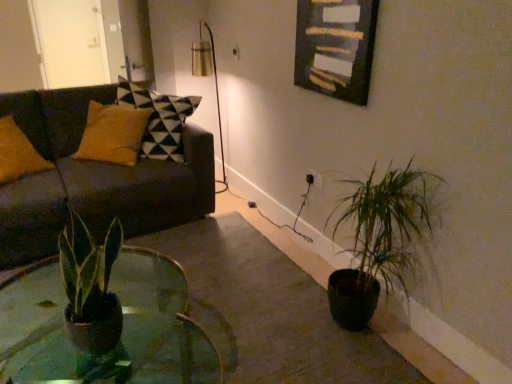
Find the location of `metallic gold table lamp at upper center`. metallic gold table lamp at upper center is located at coordinates (214, 81).

In order to face green glass coffee table at center, should I rotate leftwards or rightwards?

It's best to rotate left around 19.432 degrees.

Measure the distance between green glass coffee table at center and camera.

green glass coffee table at center is 1.78 meters from camera.

Locate an element on the screen. The height and width of the screenshot is (384, 512). wooden frame at upper center is located at coordinates (335, 47).

Identify the location of houseplant above the green glass coffee table at center (from the image's perspective). (378, 240).

Is green glass coffee table at center looking in the opposite direction of green matte plant at lower right?

Absolutely, green glass coffee table at center is directed away from green matte plant at lower right.

Is green matte plant at lower right a part of green glass coffee table at center?

No, green matte plant at lower right is not inside green glass coffee table at center.

From the picture: Considering the relative sizes of green matte plant at lower right and wooden frame at upper center in the image provided, is green matte plant at lower right smaller than wooden frame at upper center?

No.

Is green matte plant at lower right touching wooden frame at upper center?

No, green matte plant at lower right is not next to wooden frame at upper center.

In the image, is green matte plant at lower right on the left side or the right side of wooden frame at upper center?

Based on their positions, green matte plant at lower right is located to the right of wooden frame at upper center.

From the picture: Which is closer, (383, 264) or (315, 66)?

Positioned in front is point (383, 264).

Considering the positions of objects white glossy door at upper left and green glass coffee table at center in the image provided, who is more to the right, white glossy door at upper left or green glass coffee table at center?

From the viewer's perspective, green glass coffee table at center appears more on the right side.

Is white glossy door at upper left next to green glass coffee table at center?

No, white glossy door at upper left is not next to green glass coffee table at center.

How much distance is there between metallic gold table lamp at upper center and green matte plant at lower right?

metallic gold table lamp at upper center and green matte plant at lower right are 1.89 meters apart from each other.

Between metallic gold table lamp at upper center and green matte plant at lower right, which one is positioned in front?

green matte plant at lower right.

Would you say metallic gold table lamp at upper center is inside or outside green matte plant at lower right?

metallic gold table lamp at upper center cannot be found inside green matte plant at lower right.

How many degrees apart are the facing directions of metallic gold table lamp at upper center and green matte plant at lower right?

There is a 4.85-degree angle between the facing directions of metallic gold table lamp at upper center and green matte plant at lower right.

Who is shorter, green glass coffee table at center or metallic gold table lamp at upper center?

green glass coffee table at center.

How distant is green glass coffee table at center from metallic gold table lamp at upper center?

They are 5.25 feet apart.

Is green glass coffee table at center to the left or to the right of metallic gold table lamp at upper center in the image?

green glass coffee table at center is positioned on metallic gold table lamp at upper center's left side.

Locate an element on the screen. The width and height of the screenshot is (512, 384). coffee table below the metallic gold table lamp at upper center (from the image's perspective) is located at coordinates (158, 324).

Is green matte plant at lower right taller than green glass coffee table at center?

Correct, green matte plant at lower right is much taller as green glass coffee table at center.

Are green matte plant at lower right and green glass coffee table at center far apart?

They are positioned close to each other.

From the image's perspective, is green matte plant at lower right on green glass coffee table at center?

Correct, green matte plant at lower right appears higher than green glass coffee table at center in the image.

In terms of width, does green matte plant at lower right look wider or thinner when compared to green glass coffee table at center?

Considering their sizes, green matte plant at lower right looks slimmer than green glass coffee table at center.

From the image's perspective, is green glass coffee table at center above dark gray fabric couch at left?

No, from the image's perspective, green glass coffee table at center is not above dark gray fabric couch at left.

Considering the sizes of objects green glass coffee table at center and dark gray fabric couch at left in the image provided, who is thinner, green glass coffee table at center or dark gray fabric couch at left?

green glass coffee table at center is thinner.

Choose the correct answer: Is green glass coffee table at center inside dark gray fabric couch at left or outside it?

The correct answer is: outside.

Which object is further away from the camera taking this photo, green glass coffee table at center or dark gray fabric couch at left?

dark gray fabric couch at left.

Identify the location of houseplant located above the green glass coffee table at center (from the image's perspective). (378, 240).

The width and height of the screenshot is (512, 384). In order to click on houseplant in front of the wooden frame at upper center in this screenshot , I will do `click(378, 240)`.

Which object lies further to the anchor point green matte plant at lower right, wooden frame at upper center or white glossy door at upper left?

Based on the image, white glossy door at upper left appears to be further to green matte plant at lower right.

Estimate the real-world distances between objects in this image. Which object is closer to metallic gold table lamp at upper center, green glass coffee table at center or white glossy door at upper left?

Based on the image, white glossy door at upper left appears to be nearer to metallic gold table lamp at upper center.

Based on their spatial positions, is white glossy door at upper left or metallic gold table lamp at upper center further from green glass coffee table at center?

white glossy door at upper left is positioned further to the anchor green glass coffee table at center.

Estimate the real-world distances between objects in this image. Which object is closer to white glossy door at upper left, metallic gold table lamp at upper center or green glass coffee table at center?

Among the two, metallic gold table lamp at upper center is located nearer to white glossy door at upper left.

Considering their positions, is wooden frame at upper center positioned further to green glass coffee table at center than dark gray fabric couch at left?

The object further to green glass coffee table at center is wooden frame at upper center.

Estimate the real-world distances between objects in this image. Which object is further from green glass coffee table at center, metallic gold table lamp at upper center or white glossy door at upper left?

white glossy door at upper left is further to green glass coffee table at center.

Considering their positions, is metallic gold table lamp at upper center positioned closer to green matte plant at lower right than dark gray fabric couch at left?

Based on the image, dark gray fabric couch at left appears to be nearer to green matte plant at lower right.

Which object lies further to the anchor point wooden frame at upper center, metallic gold table lamp at upper center or dark gray fabric couch at left?

metallic gold table lamp at upper center is positioned further to the anchor wooden frame at upper center.

You are a GUI agent. You are given a task and a screenshot of the screen. Output one action in this format:
    pyautogui.click(x=<x>, y=<y>)
    Task: Click on the table lamp located between green matte plant at lower right and white glossy door at upper left in the depth direction
    The width and height of the screenshot is (512, 384).
    Given the screenshot: What is the action you would take?
    coord(214,81)

You are a GUI agent. You are given a task and a screenshot of the screen. Output one action in this format:
    pyautogui.click(x=<x>, y=<y>)
    Task: Click on the houseplant between green glass coffee table at center and white glossy door at upper left along the z-axis
    
    Given the screenshot: What is the action you would take?
    pyautogui.click(x=378, y=240)

You are a GUI agent. You are given a task and a screenshot of the screen. Output one action in this format:
    pyautogui.click(x=<x>, y=<y>)
    Task: Click on the table lamp between green glass coffee table at center and white glossy door at upper left in the front-back direction
    The height and width of the screenshot is (384, 512).
    Given the screenshot: What is the action you would take?
    pyautogui.click(x=214, y=81)

Find the location of a particular element. The width and height of the screenshot is (512, 384). table lamp located between dark gray fabric couch at left and white glossy door at upper left in the depth direction is located at coordinates (214, 81).